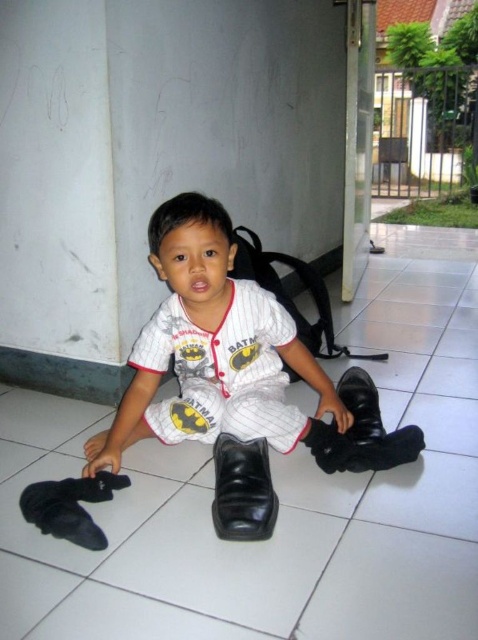
Question: Which point is farther to the camera?

Choices:
 (A) white fabric baseball uniform at center
 (B) black leather shoe at center
 (C) black leather boot at lower center
 (D) matte black shoes at center

Answer: (C)

Question: Among these objects, which one is nearest to the camera?

Choices:
 (A) matte black shoes at center
 (B) black leather shoe at center
 (C) white fabric baseball uniform at center
 (D) black leather boot at lower center

Answer: (B)

Question: Which object is the closest to the white fabric baseball uniform at center?

Choices:
 (A) black leather shoe at center
 (B) matte black shoes at center

Answer: (B)

Question: Can you confirm if matte black shoes at center is positioned above black leather boot at lower center?

Choices:
 (A) no
 (B) yes

Answer: (B)

Question: Does white fabric baseball uniform at center lie in front of black leather shoe at center?

Choices:
 (A) yes
 (B) no

Answer: (B)

Question: Does matte black shoes at center have a lesser width compared to white fabric baseball uniform at center?

Choices:
 (A) no
 (B) yes

Answer: (A)